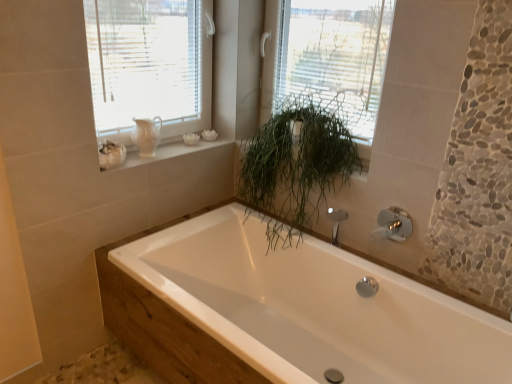
You are a GUI agent. You are given a task and a screenshot of the screen. Output one action in this format:
    pyautogui.click(x=<x>, y=<y>)
    Task: Click on the free space behind matte white pitcher at upper left
    
    Given the screenshot: What is the action you would take?
    pyautogui.click(x=164, y=146)